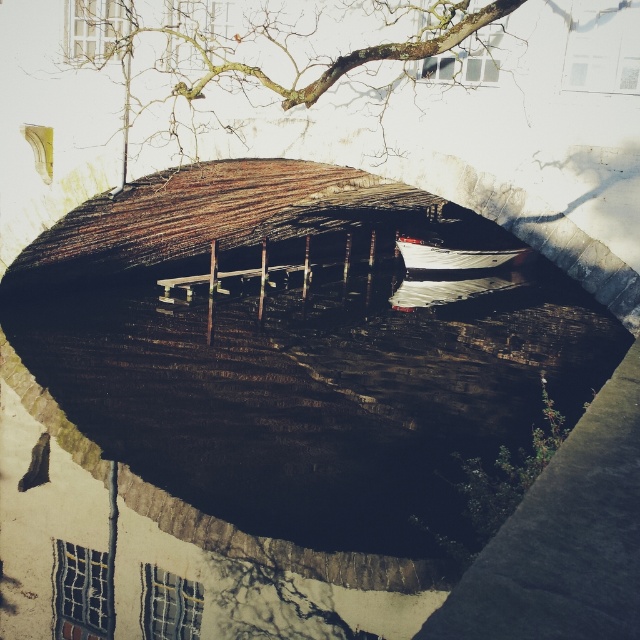
You are standing under the stone bridge and looking through the archway. You see the bare branches at upper center and the white glossy boat at center. Which object is closer to you?

The bare branches at upper center is closer to you because it is in front of the white glossy boat at center.

You are an artist sketching the scene through the stone bridge arch. You notice the bare branches at upper center and the white glossy boat at center. Which object should you draw first to ensure proper perspective, considering their relative sizes?

You should draw the bare branches at upper center first because they are larger and closer to the viewer compared to the white glossy boat at center, which is smaller and farther away.